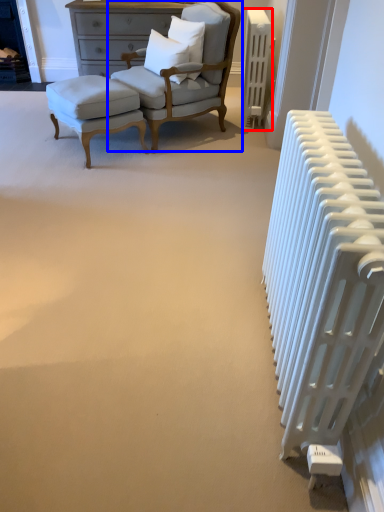
Question: Among these objects, which one is nearest to the camera, radiator (highlighted by a red box) or chair (highlighted by a blue box)?

Choices:
 (A) radiator
 (B) chair

Answer: (B)